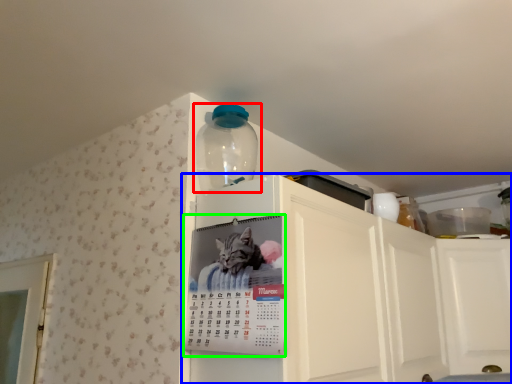
Question: Which object is positioned farthest from bottle (highlighted by a red box)? Select from cabinetry (highlighted by a blue box) and poster (highlighted by a green box).

Choices:
 (A) cabinetry
 (B) poster

Answer: (A)